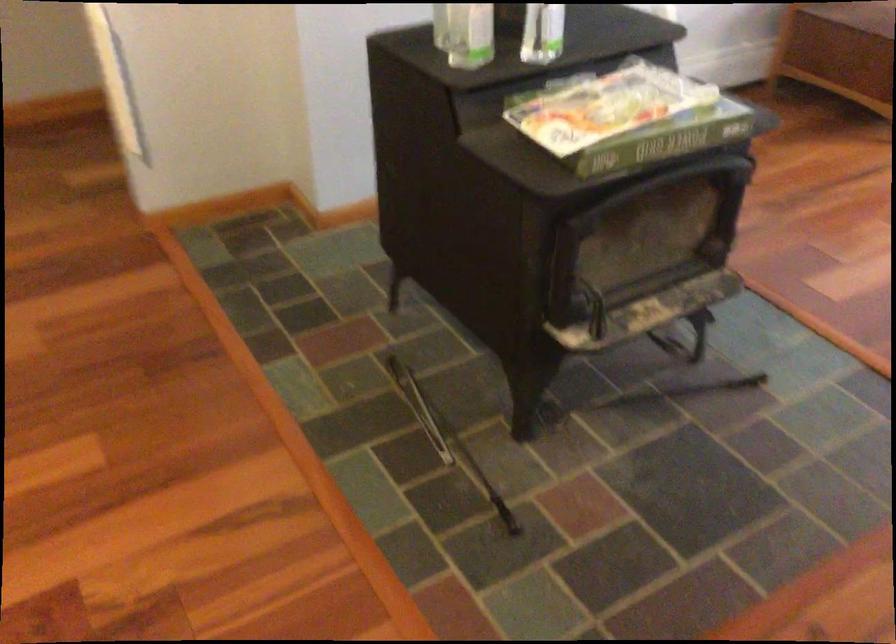
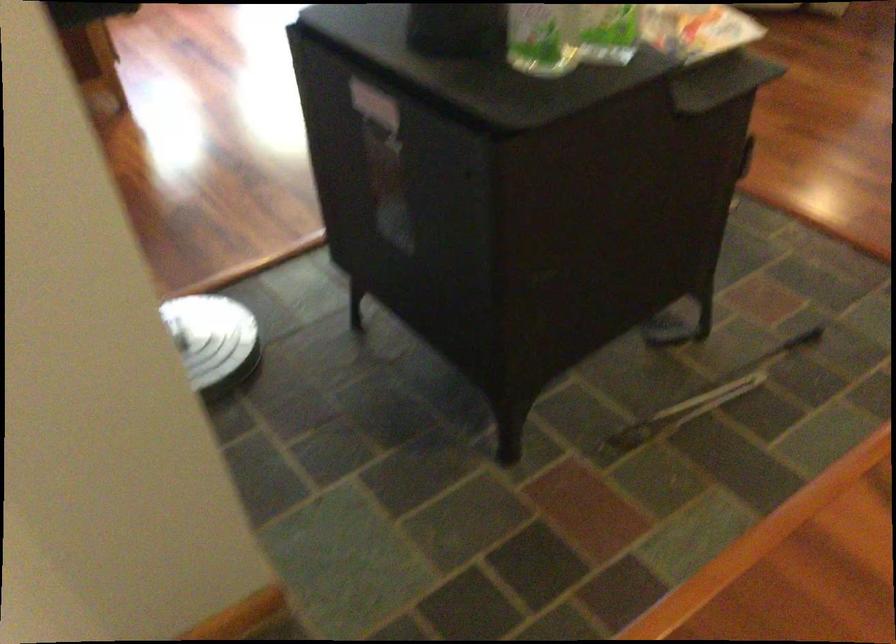
The point at (x=416, y=404) is marked in the first image. Where is the corresponding point in the second image?

(702, 399)